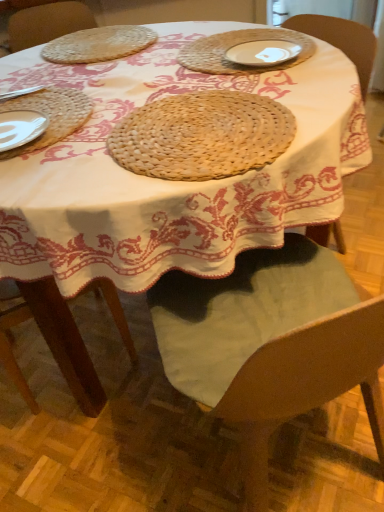
Question: Which is correct: woven straw placemat at left is inside natural woven placemat at center, the 1th pie in the front-to-back sequence, or outside of it?

Choices:
 (A) outside
 (B) inside

Answer: (A)

Question: Would you say woven straw placemat at left is to the left or to the right of natural woven placemat at center, the 1th pie in the front-to-back sequence, in the picture?

Choices:
 (A) right
 (B) left

Answer: (B)

Question: Which object is the farthest from the wooden chair at center?

Choices:
 (A) white ceramic plate at upper center
 (B) natural woven placemat at center, which is the 1th pie from bottom to top
 (C) woven straw placemat at upper left, acting as the 2th pie starting from the bottom
 (D) woven straw placemat at left

Answer: (C)

Question: Which is nearer to the woven straw placemat at left?

Choices:
 (A) natural woven placemat at center, placed as the second pie when sorted from top to bottom
 (B) wooden chair at center
 (C) white ceramic plate at upper center
 (D) woven straw placemat at upper left, which ranks as the 2th pie in front-to-back order

Answer: (A)